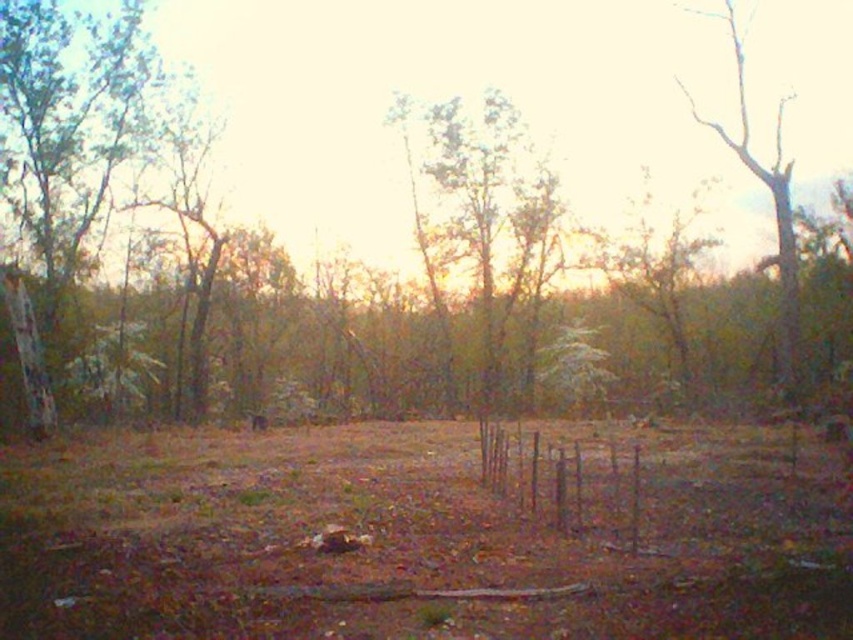
Question: Is brown dirt field at center smaller than green leafy tree at left?

Choices:
 (A) no
 (B) yes

Answer: (B)

Question: Which object appears closest to the camera in this image?

Choices:
 (A) brown wood tree at center
 (B) brown dirt field at center
 (C) green leafy tree at center

Answer: (B)

Question: Does brown wood tree at center appear under green leafy tree at center?

Choices:
 (A) yes
 (B) no

Answer: (B)

Question: Which point is closer to the camera?

Choices:
 (A) (97, 568)
 (B) (71, 193)
 (C) (628, 484)

Answer: (A)

Question: Among these points, which one is nearest to the camera?

Choices:
 (A) (509, 74)
 (B) (451, 184)
 (C) (36, 6)

Answer: (C)

Question: Considering the relative positions of brown dirt field at center and brown wood tree at center in the image provided, where is brown dirt field at center located with respect to brown wood tree at center?

Choices:
 (A) above
 (B) below

Answer: (B)